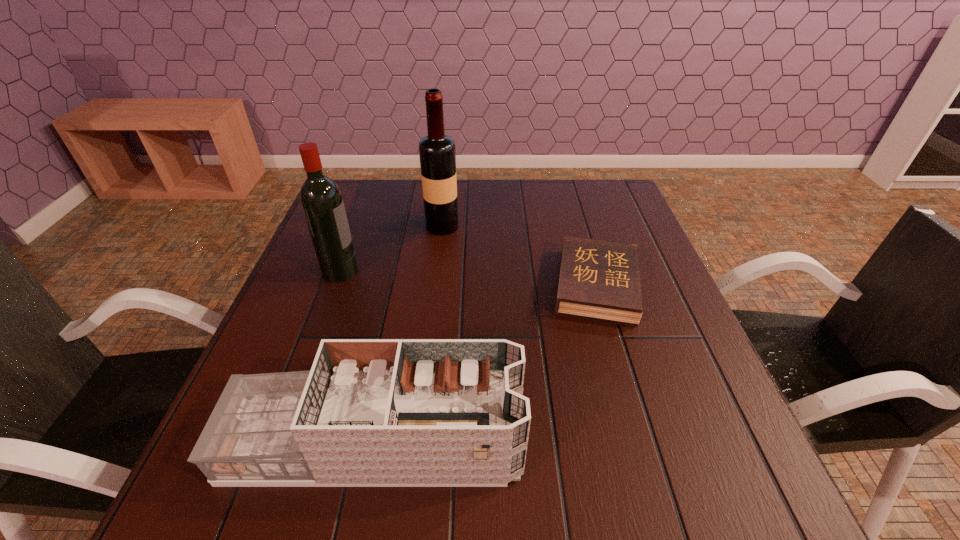
Where is `object that is the closest to the farthest object`? object that is the closest to the farthest object is located at coordinates (321, 199).

Find the location of a particular element. free space that satisfies the following two spatial constraints: 1. on the back side of the shortest object; 2. on the label of the left wine bottle is located at coordinates click(592, 271).

Where is `free space that satisfies the following two spatial constraints: 1. on the label of the left wine bottle; 2. on the back side of the hardback book`? The width and height of the screenshot is (960, 540). free space that satisfies the following two spatial constraints: 1. on the label of the left wine bottle; 2. on the back side of the hardback book is located at coordinates (335, 286).

This screenshot has width=960, height=540. What are the coordinates of `free space that satisfies the following two spatial constraints: 1. on the back side of the shortest object; 2. on the label of the nearer wine bottle` in the screenshot? It's located at (592, 271).